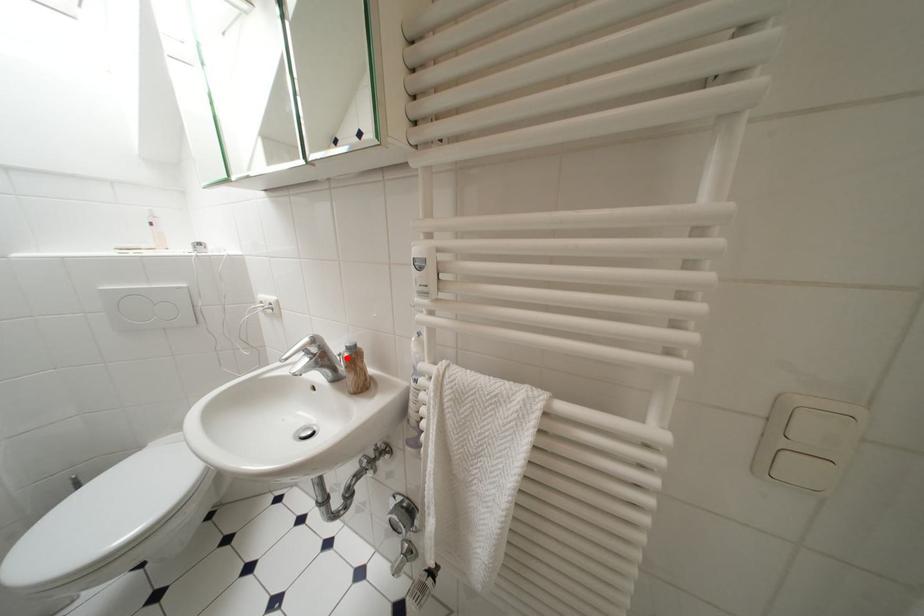
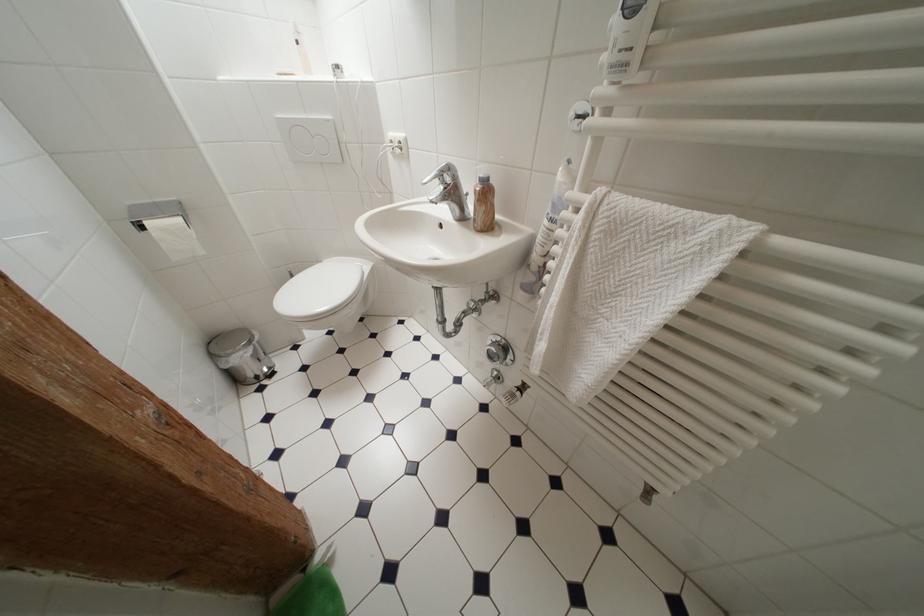
The point at the highlighted location is marked in the first image. Where is the corresponding point in the second image?

(473, 197)